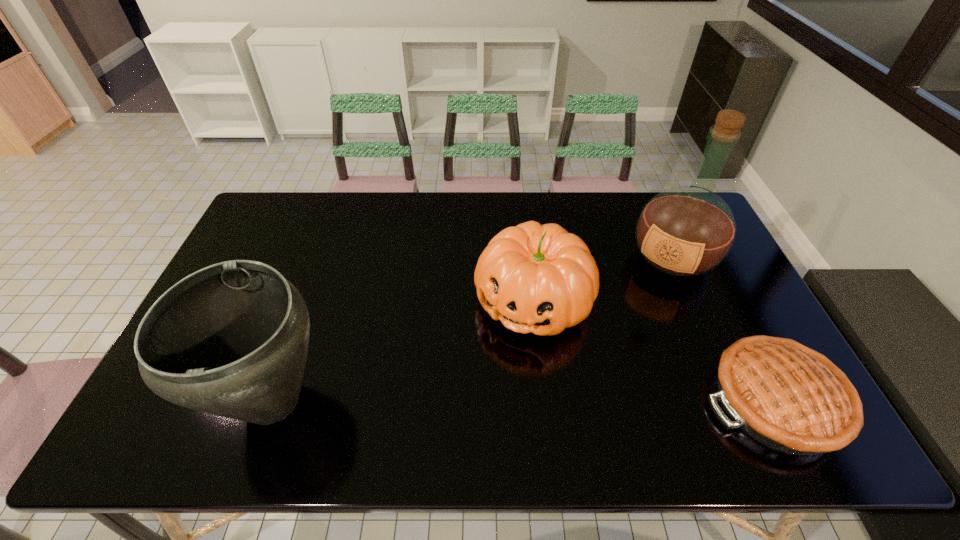
What are the coordinates of `urn` in the screenshot? It's located at (231, 339).

Identify the location of the third shortest object. Image resolution: width=960 pixels, height=540 pixels. (231, 339).

I want to click on pie, so click(x=791, y=398).

The image size is (960, 540). Identify the location of the tallest object. (685, 231).

Locate an element on the screen. pumpkin is located at coordinates click(x=535, y=278).

This screenshot has height=540, width=960. I want to click on the third object from right to left, so click(535, 278).

In order to click on free space located on the left of the leftmost object in this screenshot , I will do `click(177, 400)`.

Locate an element on the screen. The width and height of the screenshot is (960, 540). free space located 0.090m on the back of the shortest object is located at coordinates (735, 323).

Where is `free space located 0.390m on the front label of the tallest object`? The width and height of the screenshot is (960, 540). free space located 0.390m on the front label of the tallest object is located at coordinates (601, 373).

Where is `vacant space located on the front label of the tallest object`? vacant space located on the front label of the tallest object is located at coordinates (635, 319).